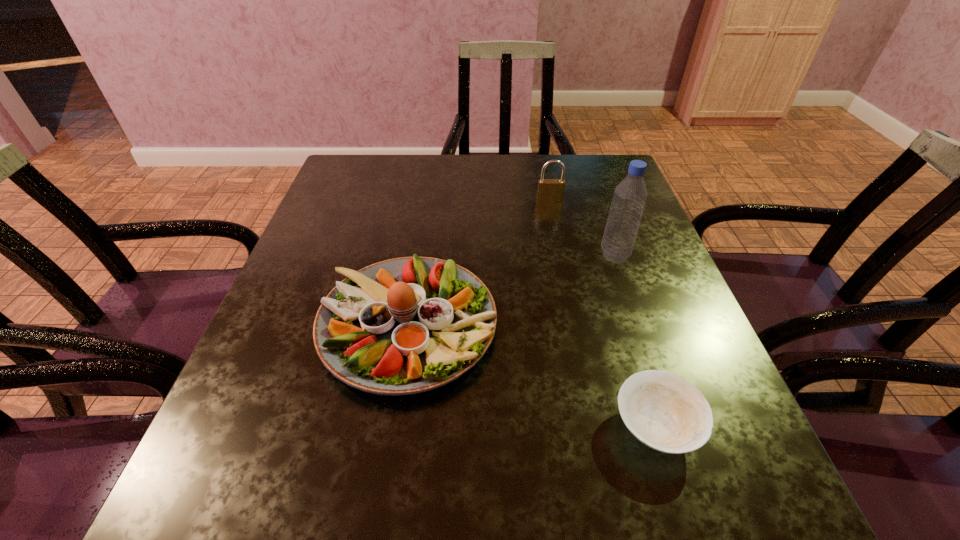
In order to click on the third nearest object in this screenshot , I will do `click(629, 198)`.

Locate an element on the screen. the tallest object is located at coordinates (629, 198).

You are a GUI agent. You are given a task and a screenshot of the screen. Output one action in this format:
    pyautogui.click(x=<x>, y=<y>)
    Task: Click on the farthest object
    
    Given the screenshot: What is the action you would take?
    pyautogui.click(x=549, y=190)

This screenshot has width=960, height=540. Find the location of `salad plate`. salad plate is located at coordinates (403, 326).

The image size is (960, 540). I want to click on bowl, so click(x=665, y=412).

Where is `vacant space located 0.310m on the front of the third nearest object`? This screenshot has height=540, width=960. vacant space located 0.310m on the front of the third nearest object is located at coordinates (660, 390).

This screenshot has height=540, width=960. I want to click on vacant space positioned 0.230m on the front-facing side of the padlock, so click(563, 261).

Identify the location of vacant space located on the front of the leftmost object. (383, 487).

The height and width of the screenshot is (540, 960). In order to click on free region located on the left of the bowl in this screenshot , I will do `click(522, 427)`.

Image resolution: width=960 pixels, height=540 pixels. In order to click on object at the far edge in this screenshot , I will do `click(549, 190)`.